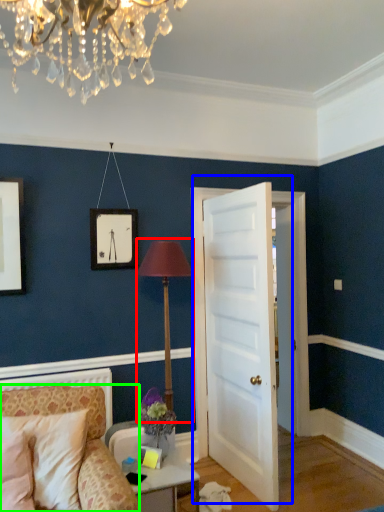
Question: Which object is the farthest from table lamp (highlighted by a red box)? Choose among these: door (highlighted by a blue box) or chair (highlighted by a green box).

Choices:
 (A) door
 (B) chair

Answer: (B)